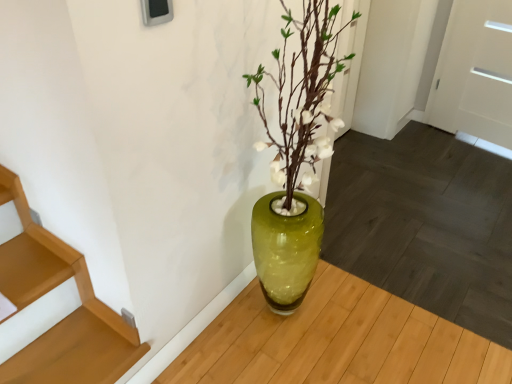
Identify the location of vacant point above wooden stairs at lower left (from a real-world perspective). (75, 350).